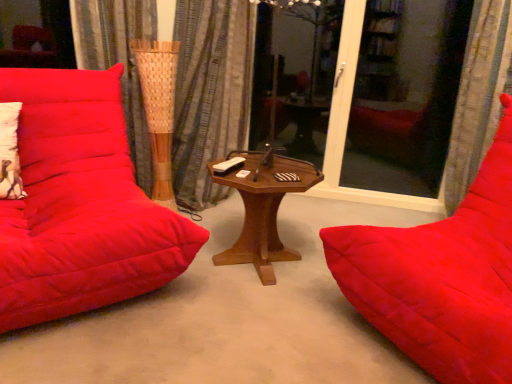
The width and height of the screenshot is (512, 384). In order to click on textured fabric curtain at right, the 1th curtain in the right-to-left sequence in this screenshot , I will do `click(477, 97)`.

Image resolution: width=512 pixels, height=384 pixels. Describe the element at coordinates (264, 207) in the screenshot. I see `wooden hexagonal table at center` at that location.

I want to click on velvet red studio couch at right, which ranks as the first studio couch in right-to-left order, so click(441, 277).

From a real-world perspective, between velvet red studio couch at right, which ranks as the first studio couch in right-to-left order, and velvet red studio couch at left, the first studio couch in the left-to-right sequence, who is vertically lower?

velvet red studio couch at right, which ranks as the first studio couch in right-to-left order.

Where is `studio couch positioned vertically above the velvet red studio couch at right, which ranks as the first studio couch in right-to-left order (from a real-world perspective)`? This screenshot has width=512, height=384. studio couch positioned vertically above the velvet red studio couch at right, which ranks as the first studio couch in right-to-left order (from a real-world perspective) is located at coordinates (80, 204).

Is velvet red studio couch at right, which ranks as the first studio couch in right-to-left order, positioned before velvet red studio couch at left, the first studio couch in the left-to-right sequence?

Yes, velvet red studio couch at right, which ranks as the first studio couch in right-to-left order, is closer to the camera.

Is point (436, 265) positioned behind point (100, 285)?

No, (436, 265) is in front of (100, 285).

Based on the photo, is velvet red studio couch at left, the first studio couch in the left-to-right sequence, wider or thinner than transparent glass screen door at right?

Clearly, velvet red studio couch at left, the first studio couch in the left-to-right sequence, has more width compared to transparent glass screen door at right.

Can you tell me how much velvet red studio couch at left, which is counted as the second studio couch, starting from the right, and transparent glass screen door at right differ in facing direction?

The facing directions of velvet red studio couch at left, which is counted as the second studio couch, starting from the right, and transparent glass screen door at right are 40.7 degrees apart.

Choose the correct answer: Is velvet red studio couch at left, the first studio couch in the left-to-right sequence, inside transparent glass screen door at right or outside it?

velvet red studio couch at left, the first studio couch in the left-to-right sequence, exists outside the volume of transparent glass screen door at right.

Is velvet red studio couch at left, the first studio couch in the left-to-right sequence, in contact with transparent glass screen door at right?

There is a gap between velvet red studio couch at left, the first studio couch in the left-to-right sequence, and transparent glass screen door at right.

Considering the relative sizes of blue striped curtain at center, which ranks as the first curtain in left-to-right order, and wooden hexagonal table at center in the image provided, is blue striped curtain at center, which ranks as the first curtain in left-to-right order, taller than wooden hexagonal table at center?

Correct, blue striped curtain at center, which ranks as the first curtain in left-to-right order, is much taller as wooden hexagonal table at center.

From the image's perspective, between blue striped curtain at center, which is the second curtain in right-to-left order, and wooden hexagonal table at center, which one is located above?

blue striped curtain at center, which is the second curtain in right-to-left order, from the image's perspective.

I want to click on curtain lying on the left of wooden hexagonal table at center, so [210, 93].

From a real-world perspective, relative to transparent glass screen door at right, is velvet red studio couch at right, which ranks as the first studio couch in right-to-left order, vertically above or below?

In terms of real-world spatial position, velvet red studio couch at right, which ranks as the first studio couch in right-to-left order, is below transparent glass screen door at right.

In the image, is velvet red studio couch at right, the second studio couch positioned from the left, on the left side or the right side of transparent glass screen door at right?

Based on their positions, velvet red studio couch at right, the second studio couch positioned from the left, is located to the left of transparent glass screen door at right.

From their relative heights in the image, would you say velvet red studio couch at right, the second studio couch positioned from the left, is taller or shorter than transparent glass screen door at right?

Clearly, velvet red studio couch at right, the second studio couch positioned from the left, is shorter compared to transparent glass screen door at right.

At what (x,y) coordinates should I click in order to perform the action: click on studio couch that is the 2nd object located in front of the transparent glass screen door at right. Please return your answer as a coordinate pair (x, y). The width and height of the screenshot is (512, 384). Looking at the image, I should click on (441, 277).

Does point (193, 58) lie behind point (392, 325)?

Yes, it is.

From the image's perspective, does blue striped curtain at center, which is the second curtain in right-to-left order, appear lower than velvet red studio couch at right, the second studio couch positioned from the left?

No, from the image's perspective, blue striped curtain at center, which is the second curtain in right-to-left order, is not beneath velvet red studio couch at right, the second studio couch positioned from the left.

The width and height of the screenshot is (512, 384). What are the coordinates of `the 2nd curtain behind the velvet red studio couch at right, which ranks as the first studio couch in right-to-left order` in the screenshot? It's located at (210, 93).

Could you tell me if blue striped curtain at center, which ranks as the first curtain in left-to-right order, is facing velvet red studio couch at right, the second studio couch positioned from the left?

No, blue striped curtain at center, which ranks as the first curtain in left-to-right order, does not turn towards velvet red studio couch at right, the second studio couch positioned from the left.

Which is more to the right, textured fabric curtain at right, the 1th curtain in the right-to-left sequence, or velvet red studio couch at left, which is counted as the second studio couch, starting from the right?

textured fabric curtain at right, the 1th curtain in the right-to-left sequence, is more to the right.

How different are the orientations of textured fabric curtain at right, the 1th curtain in the right-to-left sequence, and velvet red studio couch at left, which is counted as the second studio couch, starting from the right, in degrees?

The facing directions of textured fabric curtain at right, the 1th curtain in the right-to-left sequence, and velvet red studio couch at left, which is counted as the second studio couch, starting from the right, are 49 degrees apart.

Is textured fabric curtain at right, placed as the 2th curtain when sorted from left to right, next to velvet red studio couch at left, which is counted as the second studio couch, starting from the right?

No, textured fabric curtain at right, placed as the 2th curtain when sorted from left to right, is not making contact with velvet red studio couch at left, which is counted as the second studio couch, starting from the right.

Which object is wider, textured fabric curtain at right, the 1th curtain in the right-to-left sequence, or velvet red studio couch at right, the second studio couch positioned from the left?

Wider between the two is velvet red studio couch at right, the second studio couch positioned from the left.

From a real-world perspective, which is physically above, textured fabric curtain at right, placed as the 2th curtain when sorted from left to right, or velvet red studio couch at right, the second studio couch positioned from the left?

textured fabric curtain at right, placed as the 2th curtain when sorted from left to right, is physically above.

What's the angular difference between textured fabric curtain at right, placed as the 2th curtain when sorted from left to right, and velvet red studio couch at right, which ranks as the first studio couch in right-to-left order,'s facing directions?

37.8 degrees.

Is textured fabric curtain at right, the 1th curtain in the right-to-left sequence, oriented towards velvet red studio couch at right, which ranks as the first studio couch in right-to-left order?

Yes, textured fabric curtain at right, the 1th curtain in the right-to-left sequence, is aimed at velvet red studio couch at right, which ranks as the first studio couch in right-to-left order.

Find the location of a particular element. Image resolution: width=512 pixels, height=384 pixels. studio couch on the right of the velvet red studio couch at left, which is counted as the second studio couch, starting from the right is located at coordinates (441, 277).

Identify the location of the 2nd studio couch to the left when counting from the transparent glass screen door at right. The image size is (512, 384). (80, 204).

Considering their positions, is textured fabric curtain at right, the 1th curtain in the right-to-left sequence, positioned closer to velvet red studio couch at left, the first studio couch in the left-to-right sequence, than transparent glass screen door at right?

Among the two, textured fabric curtain at right, the 1th curtain in the right-to-left sequence, is located nearer to velvet red studio couch at left, the first studio couch in the left-to-right sequence.

Considering their positions, is textured fabric curtain at right, the 1th curtain in the right-to-left sequence, positioned further to blue striped curtain at center, which ranks as the first curtain in left-to-right order, than velvet red studio couch at left, the first studio couch in the left-to-right sequence?

textured fabric curtain at right, the 1th curtain in the right-to-left sequence, is further to blue striped curtain at center, which ranks as the first curtain in left-to-right order.

When comparing their distances from transparent glass screen door at right, does wooden hexagonal table at center or velvet red studio couch at left, the first studio couch in the left-to-right sequence, seem closer?

wooden hexagonal table at center is positioned closer to the anchor transparent glass screen door at right.

When comparing their distances from velvet red studio couch at right, which ranks as the first studio couch in right-to-left order, does textured fabric curtain at right, the 1th curtain in the right-to-left sequence, or blue striped curtain at center, which is the second curtain in right-to-left order, seem further?

The object further to velvet red studio couch at right, which ranks as the first studio couch in right-to-left order, is blue striped curtain at center, which is the second curtain in right-to-left order.

Which object lies nearer to the anchor point velvet red studio couch at right, which ranks as the first studio couch in right-to-left order, textured fabric curtain at right, the 1th curtain in the right-to-left sequence, or wooden hexagonal table at center?

Based on the image, wooden hexagonal table at center appears to be nearer to velvet red studio couch at right, which ranks as the first studio couch in right-to-left order.

Looking at the image, which one is located further to blue striped curtain at center, which ranks as the first curtain in left-to-right order, velvet red studio couch at right, the second studio couch positioned from the left, or transparent glass screen door at right?

Based on the image, velvet red studio couch at right, the second studio couch positioned from the left, appears to be further to blue striped curtain at center, which ranks as the first curtain in left-to-right order.

Estimate the real-world distances between objects in this image. Which object is further from transparent glass screen door at right, textured fabric curtain at right, the 1th curtain in the right-to-left sequence, or blue striped curtain at center, which ranks as the first curtain in left-to-right order?

The object further to transparent glass screen door at right is blue striped curtain at center, which ranks as the first curtain in left-to-right order.

From the image, which object appears to be farther from velvet red studio couch at right, the second studio couch positioned from the left, textured fabric curtain at right, the 1th curtain in the right-to-left sequence, or transparent glass screen door at right?

transparent glass screen door at right.

Locate an element on the screen. The height and width of the screenshot is (384, 512). table between velvet red studio couch at left, the first studio couch in the left-to-right sequence, and transparent glass screen door at right is located at coordinates pyautogui.click(x=264, y=207).

Where is `table between velvet red studio couch at left, the first studio couch in the left-to-right sequence, and velvet red studio couch at right, which ranks as the first studio couch in right-to-left order`? The width and height of the screenshot is (512, 384). table between velvet red studio couch at left, the first studio couch in the left-to-right sequence, and velvet red studio couch at right, which ranks as the first studio couch in right-to-left order is located at coordinates (264, 207).

Where is `table located between velvet red studio couch at left, which is counted as the second studio couch, starting from the right, and blue striped curtain at center, which ranks as the first curtain in left-to-right order, in the depth direction`? The height and width of the screenshot is (384, 512). table located between velvet red studio couch at left, which is counted as the second studio couch, starting from the right, and blue striped curtain at center, which ranks as the first curtain in left-to-right order, in the depth direction is located at coordinates (264, 207).

Locate an element on the screen. curtain between velvet red studio couch at left, the first studio couch in the left-to-right sequence, and transparent glass screen door at right, in the horizontal direction is located at coordinates (210, 93).